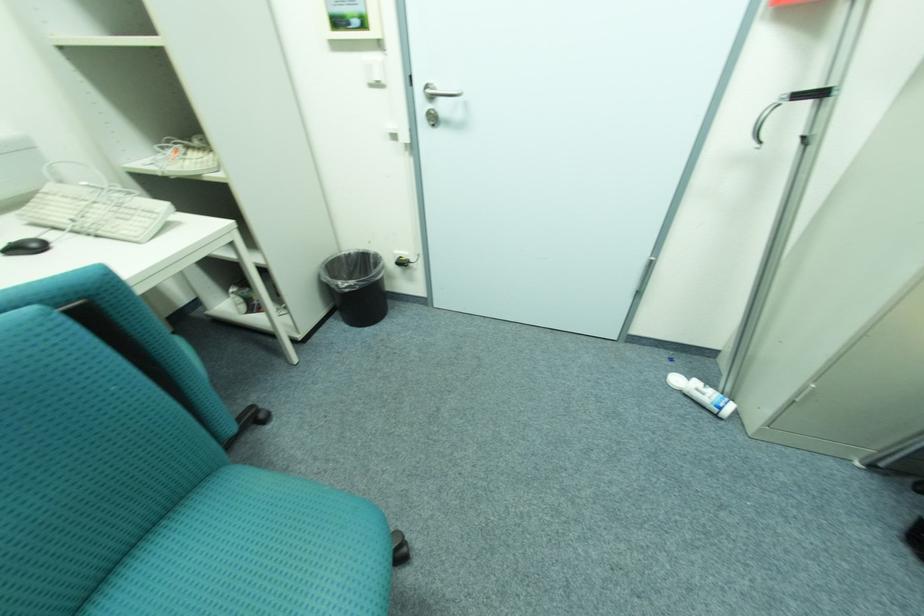
Identify the location of blue chair sitting surface. Image resolution: width=924 pixels, height=616 pixels. (238, 554).